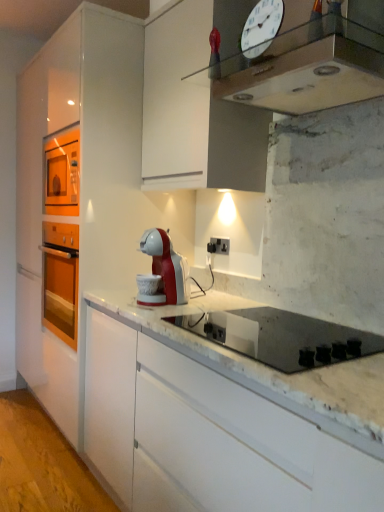
Question: Considering the positions of white glass clock at upper center and metallic silver clock at upper center in the image, is white glass clock at upper center bigger or smaller than metallic silver clock at upper center?

Choices:
 (A) small
 (B) big

Answer: (A)

Question: Is white glass clock at upper center spatially inside metallic silver clock at upper center, or outside of it?

Choices:
 (A) outside
 (B) inside

Answer: (A)

Question: Estimate the real-world distances between objects in this image. Which object is farther from the white marble countertop at lower left?

Choices:
 (A) black plastic electric outlet at center
 (B) white glass clock at upper center
 (C) metallic silver clock at upper center
 (D) white glossy cabinet at center
 (E) black glass gas stove at center

Answer: (B)

Question: Considering the real-world distances, which object is closest to the black glass gas stove at center?

Choices:
 (A) black plastic electric outlet at center
 (B) white glass clock at upper center
 (C) white marble countertop at lower left
 (D) metallic silver clock at upper center
 (E) white glossy cabinet at center

Answer: (D)